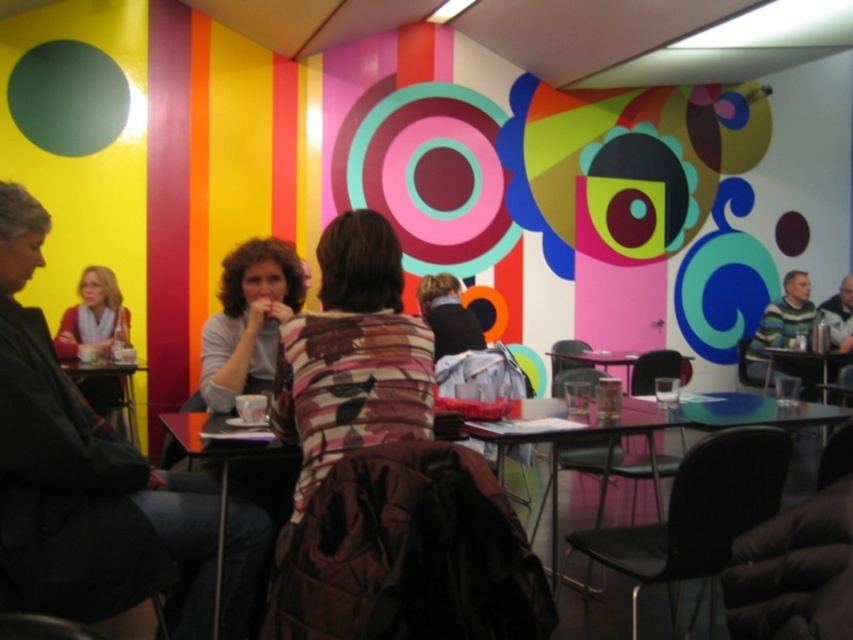
Question: Which object is the farthest from the matte black table at center?

Choices:
 (A) wooden table at left
 (B) white sweater at left
 (C) wooden table at center

Answer: (B)

Question: Is matte black table at center above wooden table at center?

Choices:
 (A) no
 (B) yes

Answer: (A)

Question: Among these points, which one is farthest from the camera?

Choices:
 (A) (74, 324)
 (B) (93, 371)
 (C) (815, 412)

Answer: (A)

Question: Does wooden table at left come behind wooden table at center?

Choices:
 (A) no
 (B) yes

Answer: (A)

Question: Can you confirm if matte black table at center is thinner than wooden table at center?

Choices:
 (A) yes
 (B) no

Answer: (B)

Question: Among these points, which one is farthest from the camera?

Choices:
 (A) (100, 358)
 (B) (764, 378)

Answer: (B)